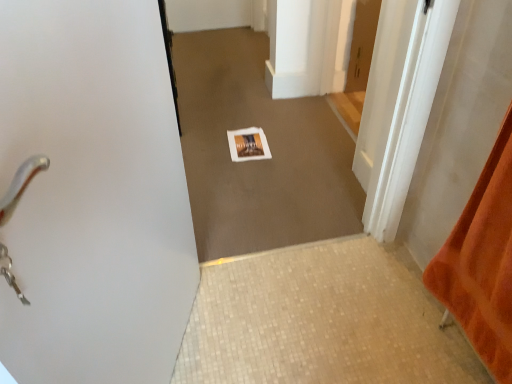
Question: Is point (388, 74) closer or farther from the camera than point (503, 347)?

Choices:
 (A) farther
 (B) closer

Answer: (A)

Question: Would you say wooden door at center, arranged as the 2th door when viewed from the back, is inside or outside orange fabric at right?

Choices:
 (A) outside
 (B) inside

Answer: (A)

Question: Based on their relative distances, which object is nearer to the brown matte door at upper right, which is the 1th door from back to front?

Choices:
 (A) white paper at center
 (B) orange fabric at right
 (C) wooden door at center, the first door when ordered from front to back
 (D) beige mosaic tile at lower center

Answer: (A)

Question: Which object is positioned farthest from the white paper at center?

Choices:
 (A) orange fabric at right
 (B) beige mosaic tile at lower center
 (C) wooden door at center, the first door when ordered from front to back
 (D) brown matte door at upper right, marked as the 2th door in a front-to-back arrangement

Answer: (A)